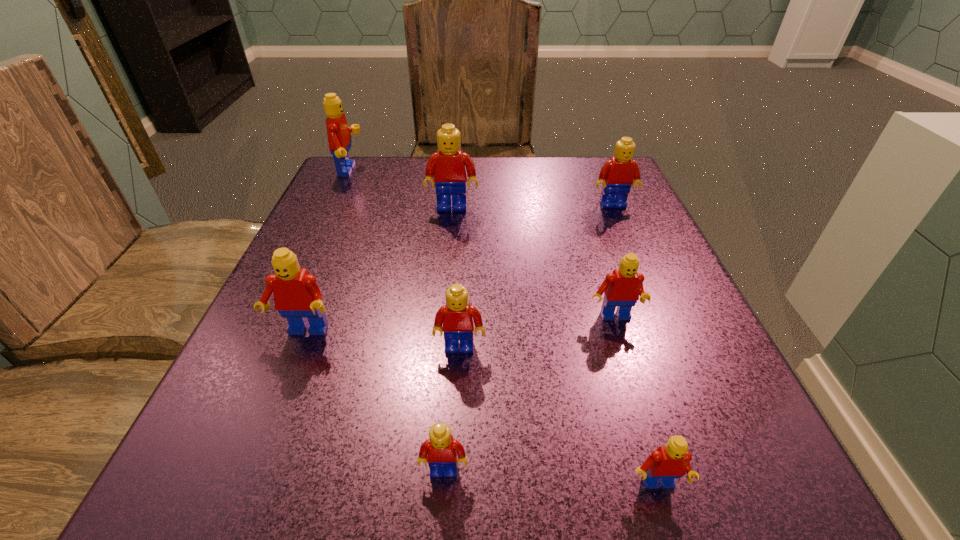
Where is `the farthest red Lego`? The width and height of the screenshot is (960, 540). the farthest red Lego is located at coordinates (339, 138).

Where is `the biggest red Lego`? the biggest red Lego is located at coordinates (339, 138).

Identify the location of the biggest yellow Lego. (450, 166).

Image resolution: width=960 pixels, height=540 pixels. What are the coordinates of `the rightmost yellow Lego` in the screenshot? It's located at (618, 174).

The image size is (960, 540). In order to click on the second biggest red Lego in this screenshot , I will do `click(297, 296)`.

The height and width of the screenshot is (540, 960). I want to click on the third biggest red Lego, so click(x=622, y=288).

This screenshot has height=540, width=960. I want to click on the third biggest yellow Lego, so (458, 317).

What are the coordinates of `the smallest yellow Lego` in the screenshot? It's located at (440, 451).

The width and height of the screenshot is (960, 540). I want to click on the smallest red Lego, so click(672, 461).

Locate an element on the screen. The image size is (960, 540). free spot located 0.350m on the front-facing side of the farthest object is located at coordinates (507, 172).